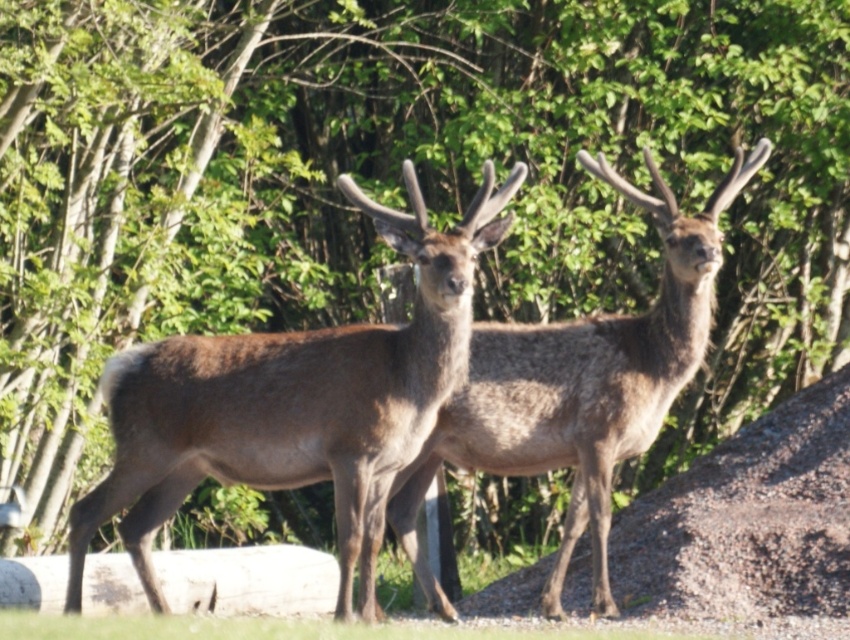
You are a wildlife photographer trying to capture both the brown matte deer at center and the brown fuzzy deer at center in a single frame. Which deer should you focus on first if you want to ensure both are in focus, considering their heights?

The brown matte deer at center is not as tall as the brown fuzzy deer at center, so you should focus on the brown fuzzy deer at center first to ensure both are in focus.